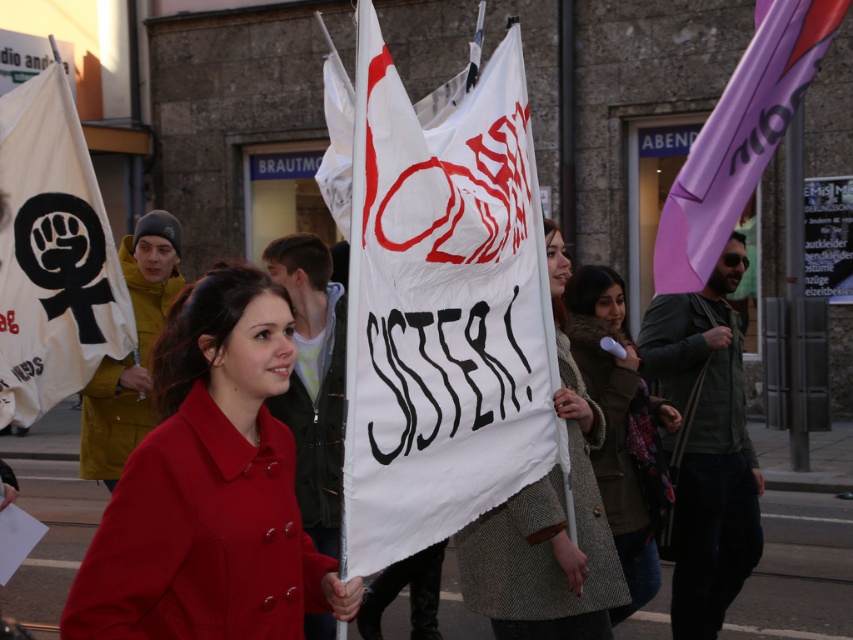
Question: Does white paper banner at center have a larger size compared to white woolen coat at center?

Choices:
 (A) no
 (B) yes

Answer: (B)

Question: Which of the following is the farthest from the observer?

Choices:
 (A) cozy woolen coat at center
 (B) white woolen coat at center

Answer: (A)

Question: Can you confirm if white woolen coat at center is wider than purple fabric flag at upper right?

Choices:
 (A) yes
 (B) no

Answer: (A)

Question: Is white paper banner at center further to camera compared to matte red coat at center?

Choices:
 (A) yes
 (B) no

Answer: (A)

Question: Among these points, which one is nearest to the camera?

Choices:
 (A) (447, 426)
 (B) (616, 486)
 (C) (331, 557)

Answer: (A)

Question: Estimate the real-world distances between objects in this image. Which object is closer to the white woolen coat at center?

Choices:
 (A) cozy woolen coat at center
 (B) white paper banner at center
 (C) white paper flag at left

Answer: (B)